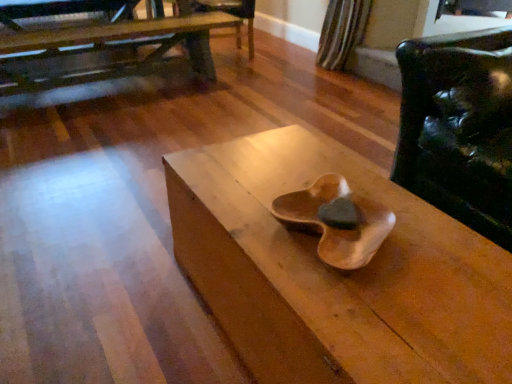
Where is `blank space above wooden table at center, which is the 1th table from front to back (from a real-world perspective)`? Image resolution: width=512 pixels, height=384 pixels. blank space above wooden table at center, which is the 1th table from front to back (from a real-world perspective) is located at coordinates (357, 233).